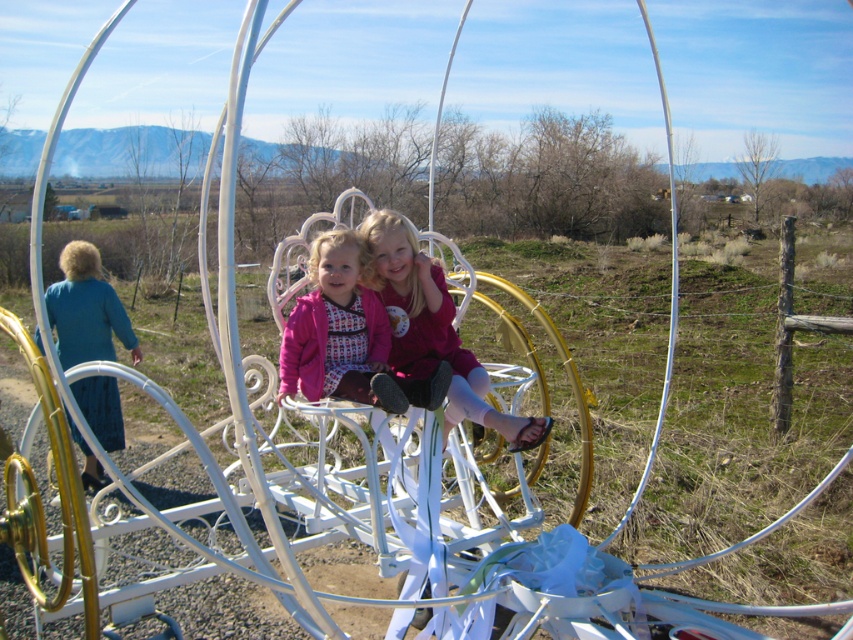
Question: Where is matte pink dress at center located in relation to matte pink jacket at center in the image?

Choices:
 (A) above
 (B) below

Answer: (A)

Question: Which object appears closest to the camera in this image?

Choices:
 (A) matte pink dress at center
 (B) matte pink jacket at center

Answer: (B)

Question: Which object appears farthest from the camera in this image?

Choices:
 (A) matte pink jacket at center
 (B) matte pink dress at center

Answer: (B)

Question: Is matte pink dress at center below matte pink jacket at center?

Choices:
 (A) no
 (B) yes

Answer: (A)

Question: Where is matte pink dress at center located in relation to matte pink jacket at center in the image?

Choices:
 (A) above
 (B) below

Answer: (A)